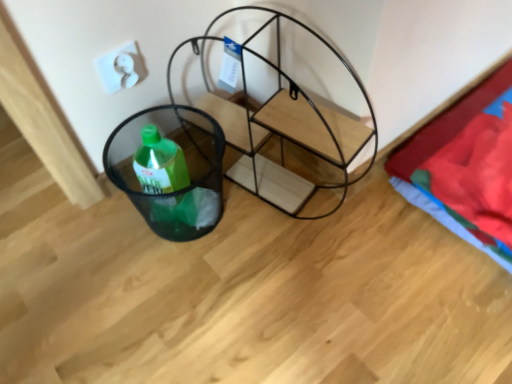
Question: Is black mesh basket at lower left wider than red cotton blanket at right?

Choices:
 (A) no
 (B) yes

Answer: (A)

Question: Considering the relative sizes of black mesh basket at lower left and red cotton blanket at right in the image provided, is black mesh basket at lower left bigger than red cotton blanket at right?

Choices:
 (A) yes
 (B) no

Answer: (B)

Question: Are black mesh basket at lower left and red cotton blanket at right far apart?

Choices:
 (A) yes
 (B) no

Answer: (B)

Question: Does black mesh basket at lower left contain red cotton blanket at right?

Choices:
 (A) no
 (B) yes

Answer: (A)

Question: From a real-world perspective, is black mesh basket at lower left located higher than red cotton blanket at right?

Choices:
 (A) no
 (B) yes

Answer: (B)

Question: Is black mesh basket at lower left inside the boundaries of red cotton blanket at right, or outside?

Choices:
 (A) outside
 (B) inside

Answer: (A)

Question: Considering the positions of black mesh basket at lower left and red cotton blanket at right in the image, is black mesh basket at lower left bigger or smaller than red cotton blanket at right?

Choices:
 (A) small
 (B) big

Answer: (A)

Question: From a real-world perspective, relative to red cotton blanket at right, is black mesh basket at lower left vertically above or below?

Choices:
 (A) below
 (B) above

Answer: (B)

Question: Relative to red cotton blanket at right, is black mesh basket at lower left in front or behind?

Choices:
 (A) behind
 (B) front

Answer: (B)

Question: Is white matte electric outlet at upper left in front of or behind red cotton blanket at right in the image?

Choices:
 (A) behind
 (B) front

Answer: (B)

Question: From a real-world perspective, is white matte electric outlet at upper left positioned above or below red cotton blanket at right?

Choices:
 (A) above
 (B) below

Answer: (A)

Question: Does point (120, 59) appear closer or farther from the camera than point (409, 165)?

Choices:
 (A) closer
 (B) farther

Answer: (A)

Question: Would you say white matte electric outlet at upper left is to the left or to the right of red cotton blanket at right in the picture?

Choices:
 (A) left
 (B) right

Answer: (A)

Question: Would you say black mesh basket at lower left is inside or outside black wire shelving unit at center?

Choices:
 (A) inside
 (B) outside

Answer: (B)

Question: Looking at their shapes, would you say black mesh basket at lower left is wider or thinner than black wire shelving unit at center?

Choices:
 (A) wide
 (B) thin

Answer: (B)